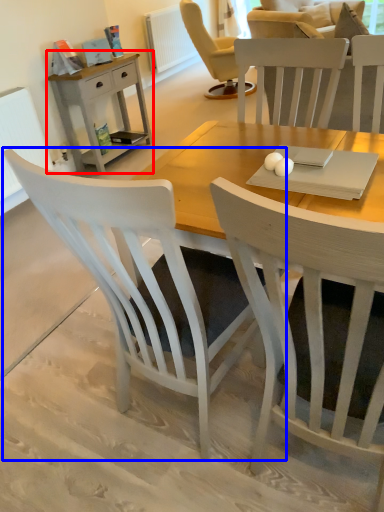
Question: Which object appears closest to the camera in this image, nightstand (highlighted by a red box) or chair (highlighted by a blue box)?

Choices:
 (A) nightstand
 (B) chair

Answer: (B)